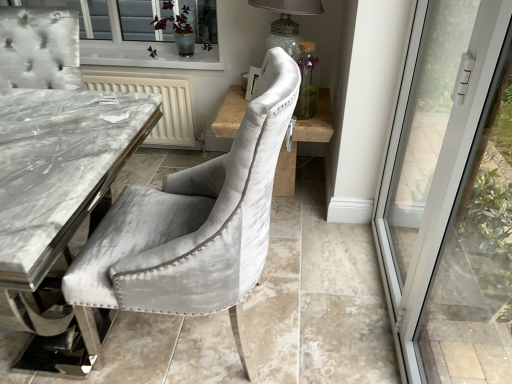
Where is `free space in front of light brown wood side table at center`? Image resolution: width=512 pixels, height=384 pixels. free space in front of light brown wood side table at center is located at coordinates (307, 242).